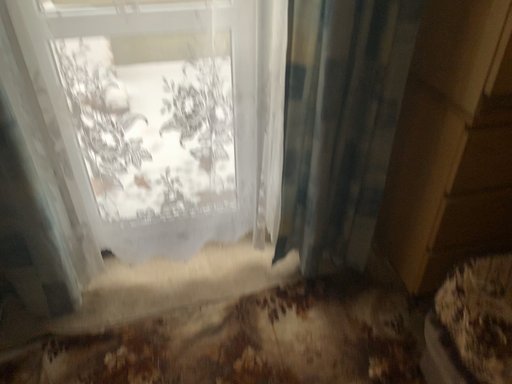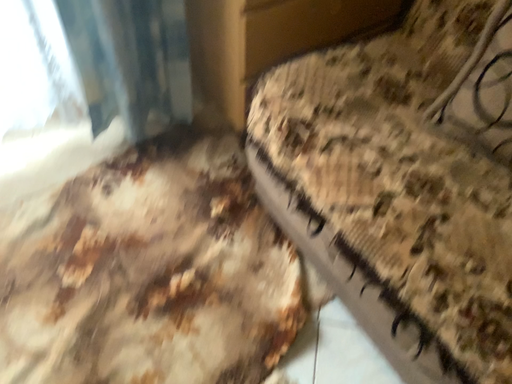
Question: How did the camera likely rotate when shooting the video?

Choices:
 (A) rotated right
 (B) rotated left

Answer: (A)